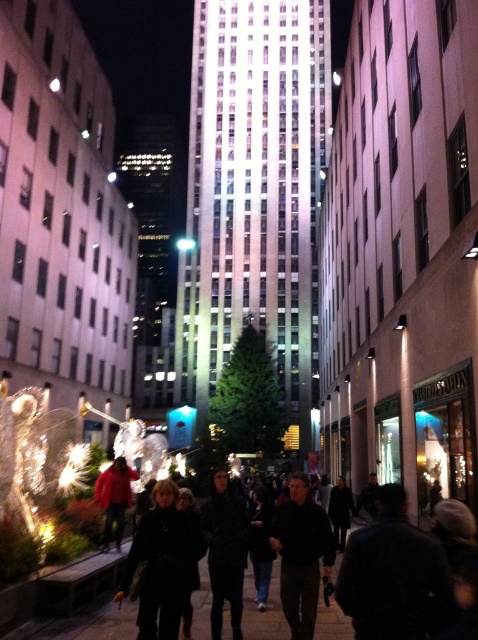
In the scene shown: You are a delivery drone with a minimum safe flying height of 15 meters. You need to fly from the skyscraper to the black matte crowd at center while avoiding obstacles. Can you safely fly over the red fabric coat at center?

The distance between the black matte crowd at center and the red fabric coat at center is 12.74 meters. Since your drone requires a minimum safe flying height of 15 meters, you cannot safely fly over the red fabric coat at center because the required height is not met.